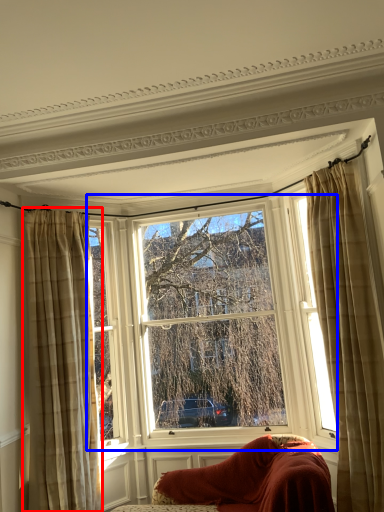
Question: Which object appears closest to the camera in this image, curtain (highlighted by a red box) or window (highlighted by a blue box)?

Choices:
 (A) curtain
 (B) window

Answer: (A)